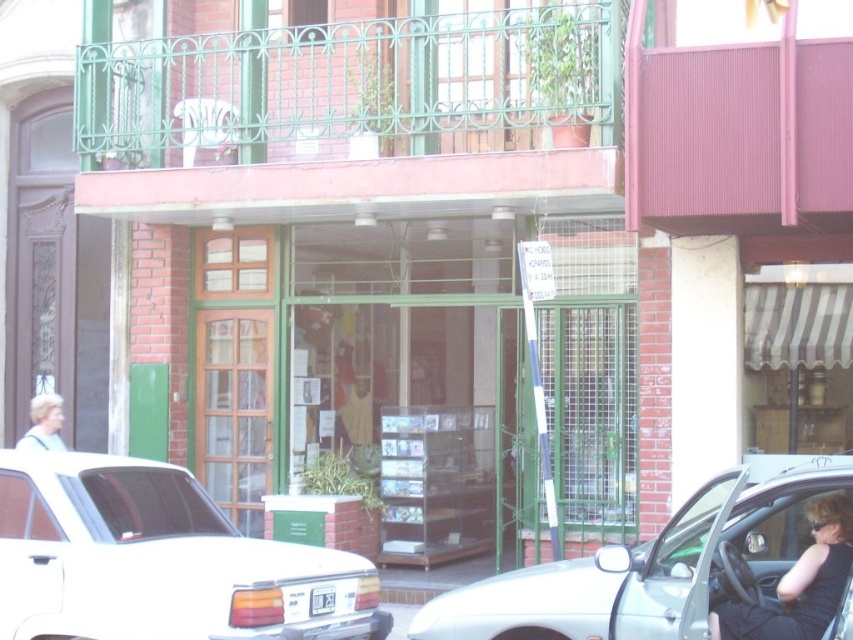
This screenshot has height=640, width=853. What do you see at coordinates (160, 561) in the screenshot? I see `white glossy sedan at center` at bounding box center [160, 561].

Image resolution: width=853 pixels, height=640 pixels. In order to click on white glossy sedan at center in this screenshot , I will do `click(160, 561)`.

Based on the photo, is silver metallic car at center wider than blonde hair at left?

Correct, the width of silver metallic car at center exceeds that of blonde hair at left.

Does point (828, 614) come closer to viewer compared to point (53, 444)?

Yes, point (828, 614) is closer to viewer.

Image resolution: width=853 pixels, height=640 pixels. Find the location of `silver metallic car at center`. silver metallic car at center is located at coordinates (683, 572).

Which is in front, point (792, 580) or point (844, 556)?

Point (844, 556)

Find the location of `silver metallic car at center`. silver metallic car at center is located at coordinates (683, 572).